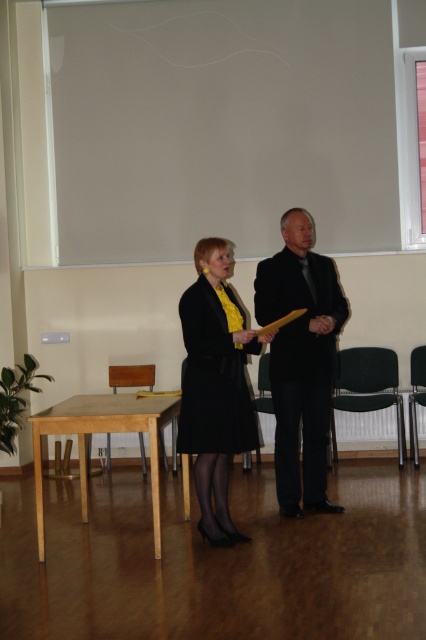
Does black plastic chair at right appear over black plastic chair at center?

Actually, black plastic chair at right is below black plastic chair at center.

Between black plastic chair at right and black plastic chair at center, which one appears on the left side from the viewer's perspective?

black plastic chair at center is more to the left.

The height and width of the screenshot is (640, 426). Identify the location of black plastic chair at right. (416, 396).

Can you confirm if matte black coat at center is bigger than black plastic chair at lower right?

Indeed, matte black coat at center has a larger size compared to black plastic chair at lower right.

How much distance is there between matte black coat at center and black plastic chair at lower right?

matte black coat at center is 2.33 meters from black plastic chair at lower right.

Who is more distant from viewer, (193,314) or (391,358)?

Positioned behind is point (391,358).

You are a GUI agent. You are given a task and a screenshot of the screen. Output one action in this format:
    pyautogui.click(x=<x>, y=<y>)
    Task: Click on the matte black coat at center
    The image size is (426, 640).
    Given the screenshot: What is the action you would take?
    pyautogui.click(x=215, y=387)

Between point (141, 374) and point (261, 360), which one is positioned in front?

Point (141, 374)

Does light brown wooden chair at lower left lie in front of black plastic chair at center?

No.

Is point (109, 465) more distant than point (267, 358)?

That is True.

Image resolution: width=426 pixels, height=640 pixels. I want to click on light brown wooden chair at lower left, so click(131, 376).